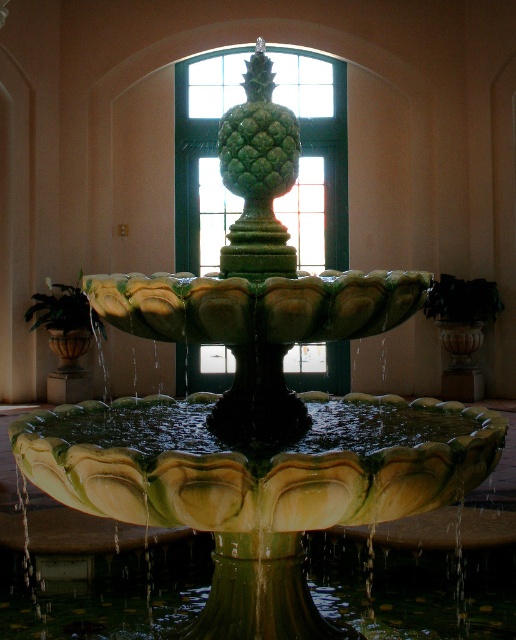
Question: Does green glass window at center have a greater width compared to green matte pineapple at center?

Choices:
 (A) yes
 (B) no

Answer: (A)

Question: Does green glass window at center have a larger size compared to green matte pineapple at center?

Choices:
 (A) yes
 (B) no

Answer: (A)

Question: In this image, where is green glass window at center located relative to green matte pineapple at center?

Choices:
 (A) above
 (B) below

Answer: (A)